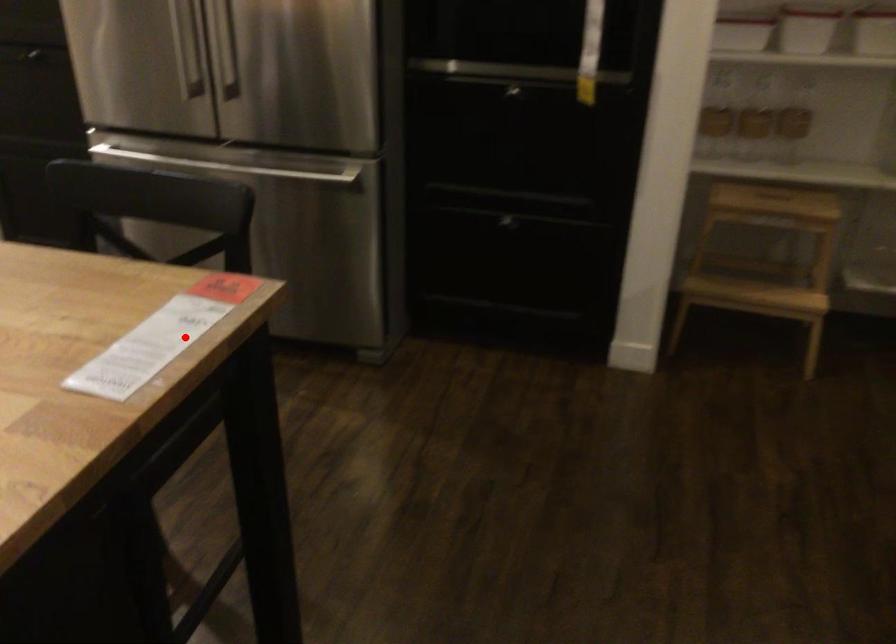
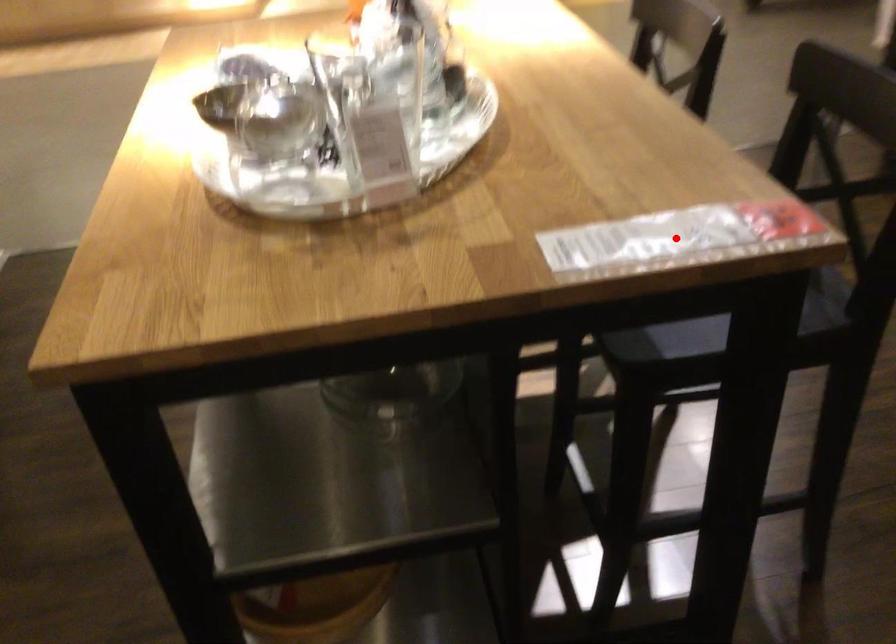
I am providing you with two images of the same scene from different viewpoints. A red point is marked on the first image and another point is marked on the second image. Does the point marked in image1 correspond to the same location as the one in image2?

Yes